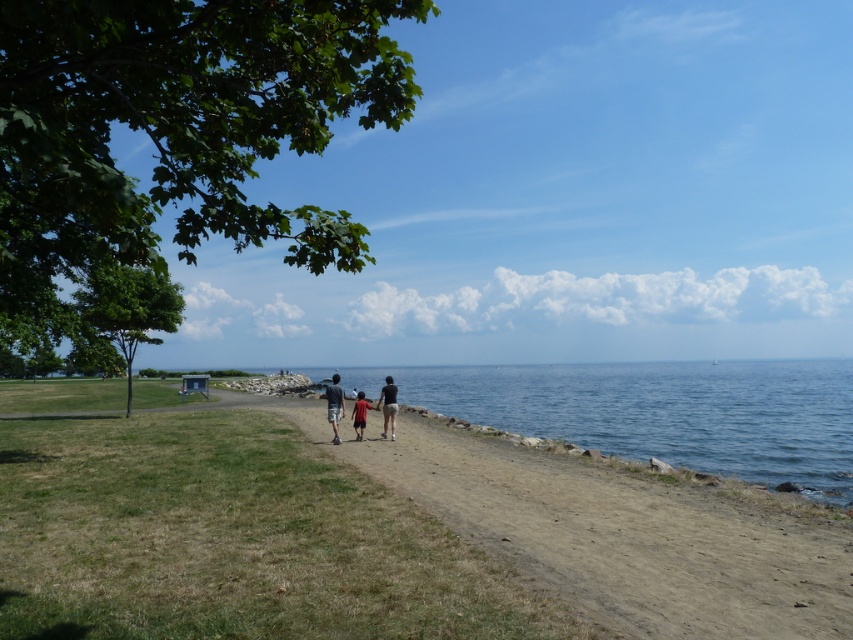
Question: Based on their relative distances, which object is farther from the blue water at lower center?

Choices:
 (A) matte gray shorts at center
 (B) dark gray shorts at center
 (C) matte black couple at center

Answer: (B)

Question: In this image, where is blue water at lower center located relative to dark gray shorts at center?

Choices:
 (A) below
 (B) above

Answer: (A)

Question: Does blue water at lower center have a greater width compared to matte gray shorts at center?

Choices:
 (A) no
 (B) yes

Answer: (B)

Question: Is blue water at lower center above red cotton shirt at center?

Choices:
 (A) no
 (B) yes

Answer: (A)

Question: Considering the real-world distances, which object is farthest from the matte black couple at center?

Choices:
 (A) dark gray shorts at center
 (B) matte gray shorts at center
 (C) blue water at lower center

Answer: (C)

Question: Which point is farther to the camera?

Choices:
 (A) (358, 428)
 (B) (395, 416)
 (C) (340, 412)
 (D) (669, 368)

Answer: (D)